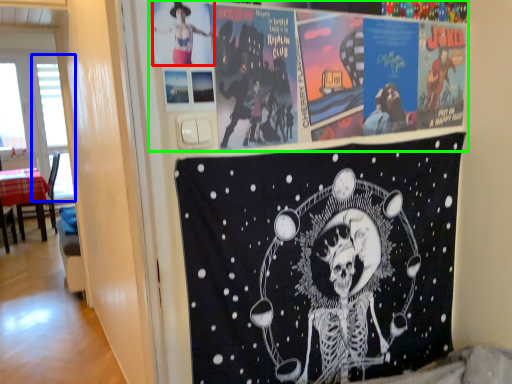
Question: Considering the real-world distances, which object is closest to person (highlighted by a red box)? window screen (highlighted by a blue box) or poster (highlighted by a green box).

Choices:
 (A) window screen
 (B) poster

Answer: (B)